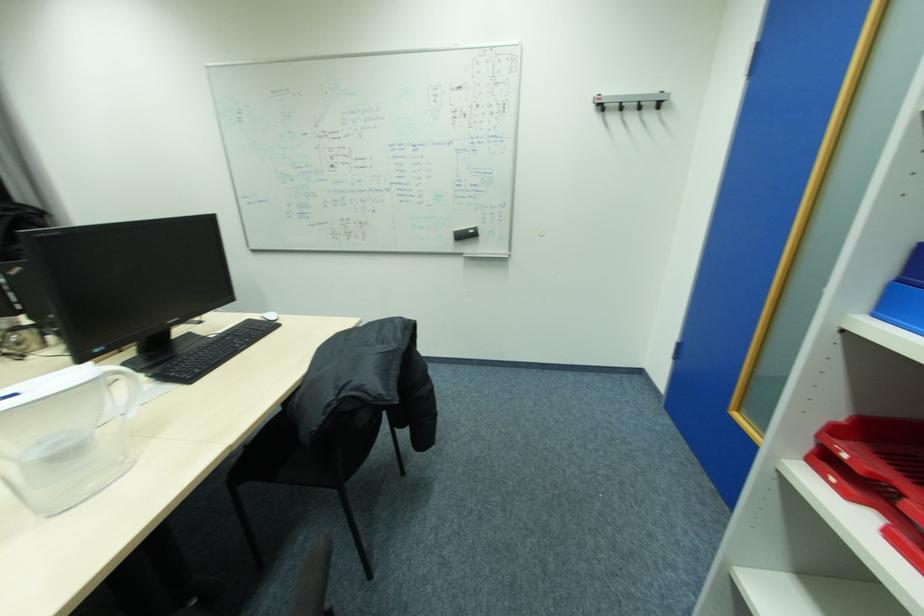
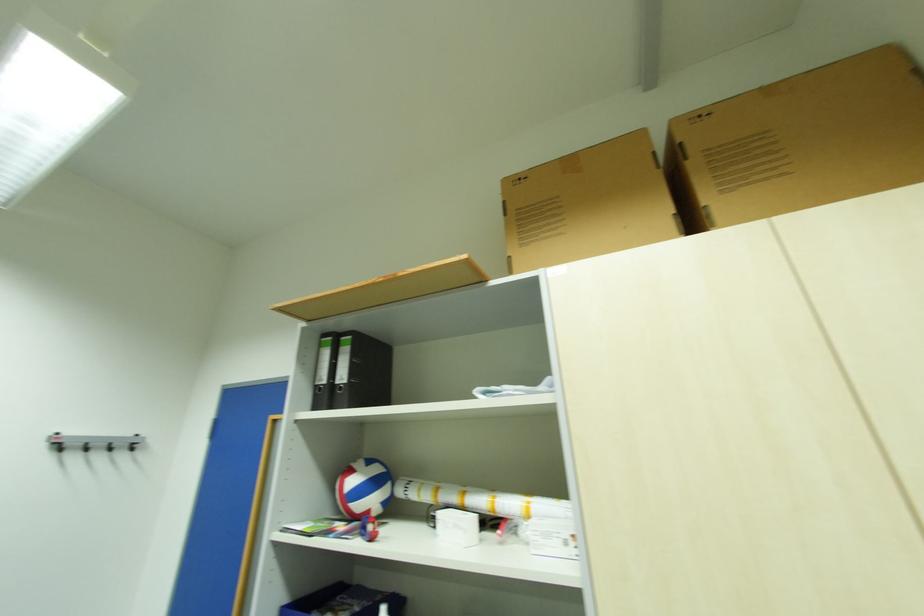
First-person continuous shooting, in which direction is the camera rotating?

The camera's rotation is toward right-up.